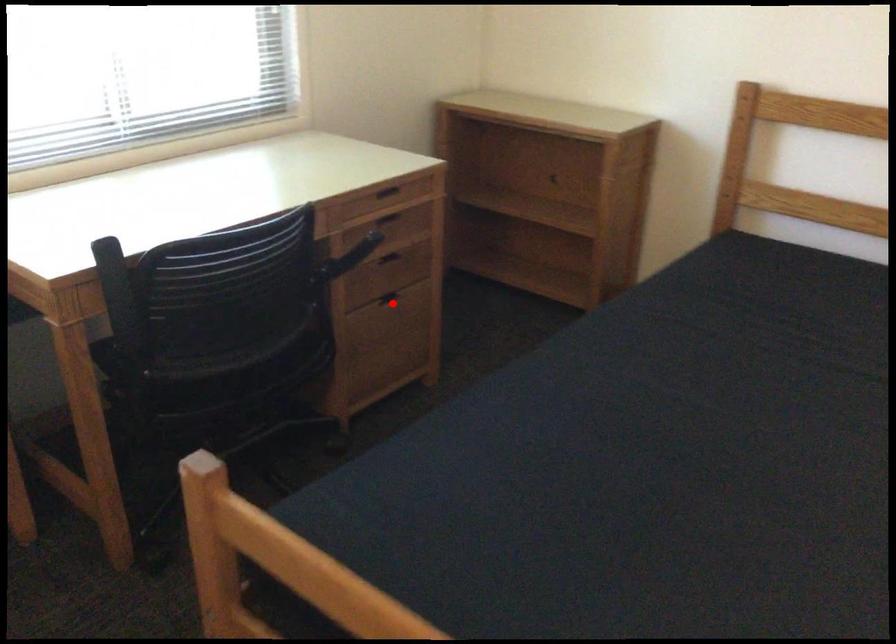
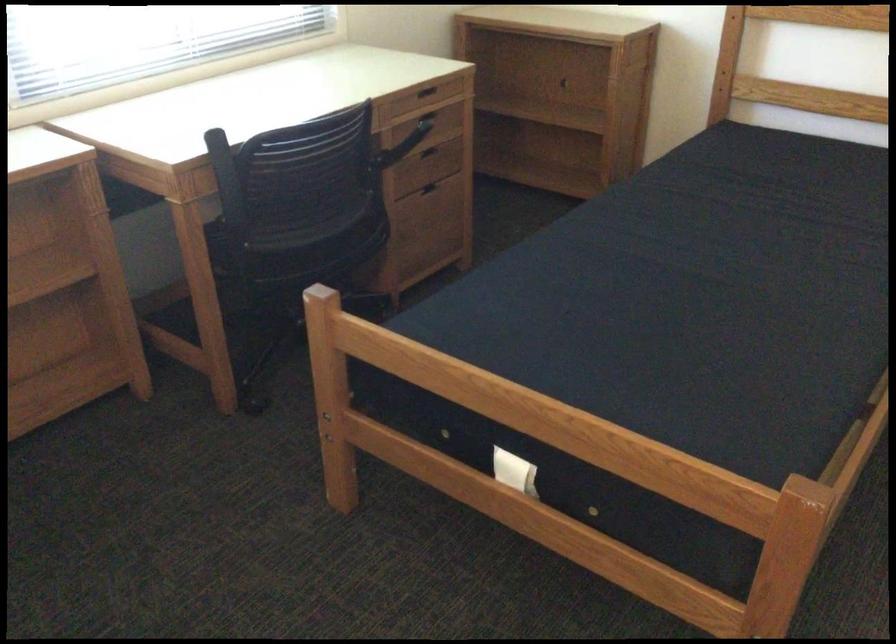
The point at the highlighted location is marked in the first image. Where is the corresponding point in the second image?

(434, 192)